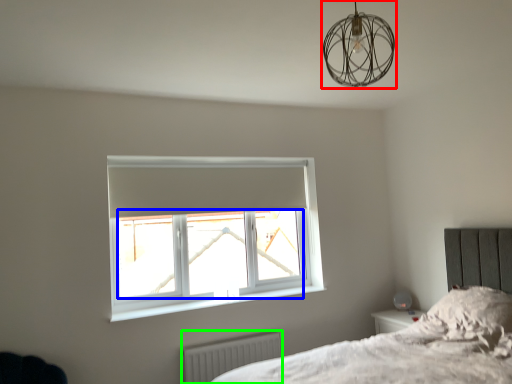
Question: Which is nearer to the lamp (highlighted by a red box)? window screen (highlighted by a blue box) or radiator (highlighted by a green box).

Choices:
 (A) window screen
 (B) radiator

Answer: (A)